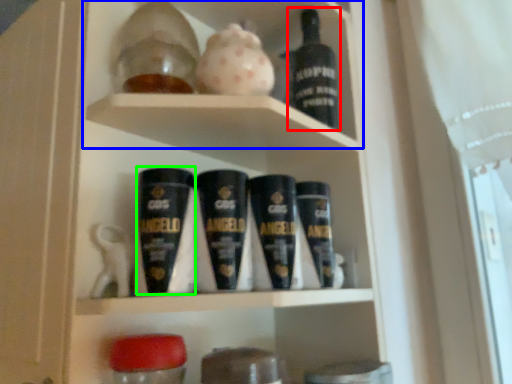
Question: Which object is the farthest from bottle (highlighted by a red box)? Choose among these: cabinet (highlighted by a blue box) or shaving cream (highlighted by a green box).

Choices:
 (A) cabinet
 (B) shaving cream

Answer: (B)